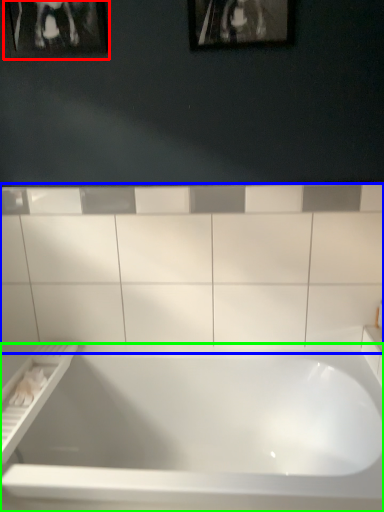
Question: Which object is the farthest from picture frame (highlighted by a red box)? Choose among these: ceramic tile (highlighted by a blue box) or bathtub (highlighted by a green box).

Choices:
 (A) ceramic tile
 (B) bathtub

Answer: (B)